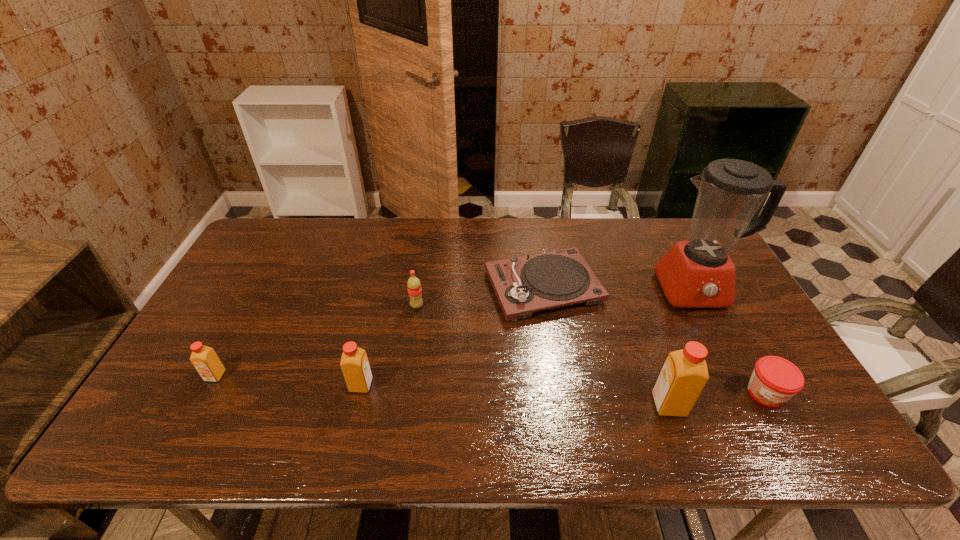
Locate an element on the screen. This screenshot has width=960, height=540. jam is located at coordinates (775, 380).

You are a GUI agent. You are given a task and a screenshot of the screen. Output one action in this format:
    pyautogui.click(x=<x>, y=<y>)
    Task: Click on the vacant space positioned 0.050m on the front and back of the leftmost orange juice
    
    Given the screenshot: What is the action you would take?
    pyautogui.click(x=203, y=400)

This screenshot has width=960, height=540. In order to click on vacant space located 0.300m on the front and back of the second object from left to right in this screenshot , I will do `click(229, 385)`.

The height and width of the screenshot is (540, 960). In order to click on vacant space located 0.290m on the front and back of the second object from left to right in this screenshot , I will do `click(233, 385)`.

Locate an element on the screen. The height and width of the screenshot is (540, 960). free space located on the front and back of the second object from left to right is located at coordinates (209, 385).

Where is `free space located 0.110m on the front and back of the sixth shortest object`? free space located 0.110m on the front and back of the sixth shortest object is located at coordinates point(731,405).

Where is `free spot located on the front of the tallest object near the controls`? The image size is (960, 540). free spot located on the front of the tallest object near the controls is located at coordinates point(752,404).

Identify the location of vacant space located on the right of the fifth object from right to left. click(x=444, y=306).

The image size is (960, 540). Identify the location of free space located 0.190m on the front of the phonograph_record. [558, 380].

Identify the location of object that is at the far edge. (523, 285).